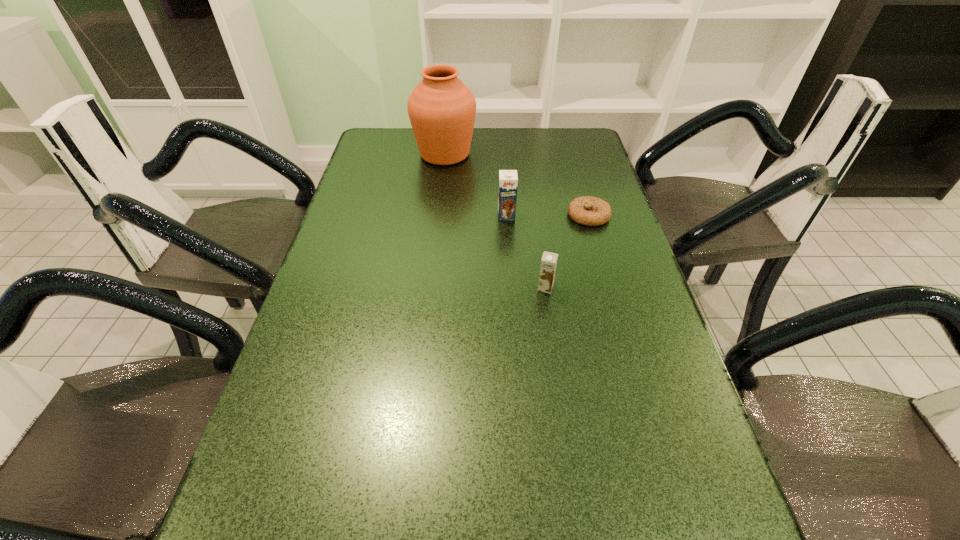
Where is `the farthest object`? the farthest object is located at coordinates [442, 110].

Find the location of a particular element. Image resolution: width=960 pixels, height=540 pixels. urn is located at coordinates (442, 110).

Identify the location of the third object from right to left. (508, 180).

In order to click on the farther chocolate milk in this screenshot , I will do `click(508, 180)`.

The image size is (960, 540). What are the coordinates of `the third object from left to right` in the screenshot? It's located at (549, 260).

Image resolution: width=960 pixels, height=540 pixels. In order to click on the nearer chocolate milk in this screenshot , I will do 549,260.

In order to click on the shortest object in this screenshot , I will do `click(599, 211)`.

At what (x,y) coordinates should I click in order to perform the action: click on the rightmost object. Please return your answer as a coordinate pair (x, y). Image resolution: width=960 pixels, height=540 pixels. Looking at the image, I should click on (599, 211).

Where is `blank space located on the left of the urn`? This screenshot has height=540, width=960. blank space located on the left of the urn is located at coordinates (366, 154).

This screenshot has height=540, width=960. What are the coordinates of `vacant space situated 0.360m on the front label of the farther chocolate milk` in the screenshot? It's located at (514, 320).